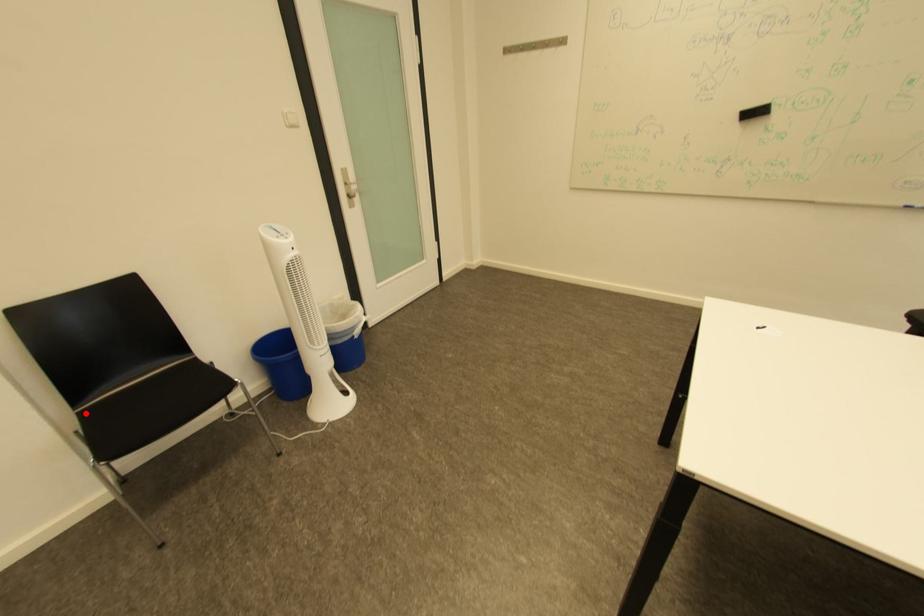
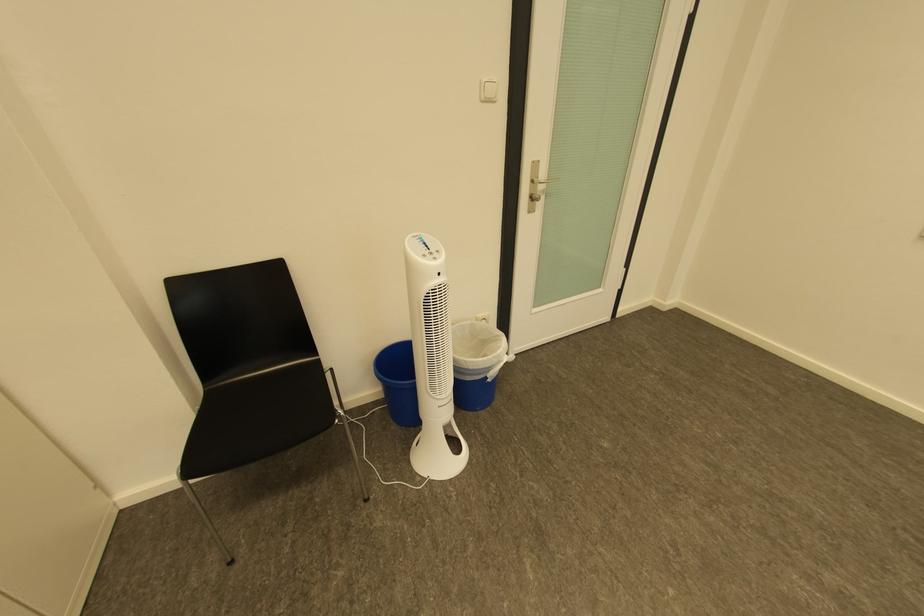
The point at the highlighted location is marked in the first image. Where is the corresponding point in the second image?

(215, 389)